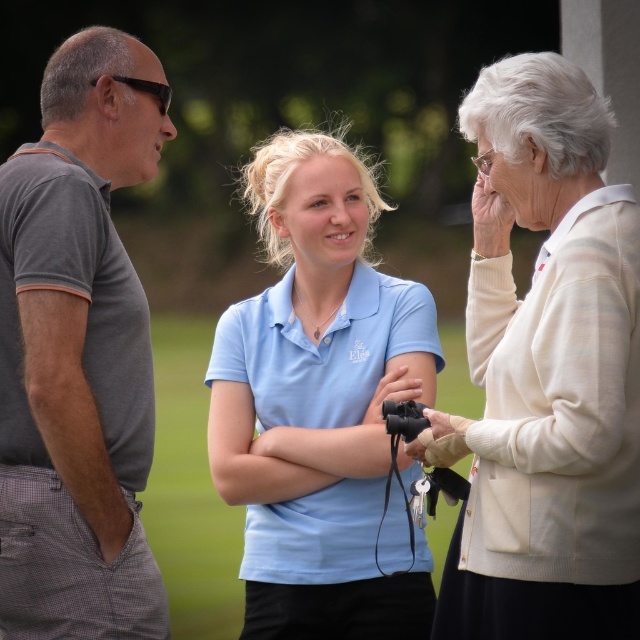
Between gray cotton polo shirt at left and black rubber binoculars at center, which one appears on the left side from the viewer's perspective?

gray cotton polo shirt at left is more to the left.

Describe the element at coordinates (77, 355) in the screenshot. I see `gray cotton polo shirt at left` at that location.

Describe the element at coordinates (77, 355) in the screenshot. The height and width of the screenshot is (640, 640). I see `gray cotton polo shirt at left` at that location.

At what (x,y) coordinates should I click in order to perform the action: click on gray cotton polo shirt at left. Please return your answer as a coordinate pair (x, y). The width and height of the screenshot is (640, 640). Looking at the image, I should click on (77, 355).

What are the coordinates of `white knit cardigan at upper right` in the screenshot? It's located at (548, 371).

Is white knit cardigan at upper right closer to the viewer compared to black rubber binoculars at center?

Yes, it is.

Who is more forward, [465,611] or [412,419]?

Point [465,611] is in front.

Where is `white knit cardigan at upper right`? white knit cardigan at upper right is located at coordinates (548, 371).

Does matte blue shirt at center appear under black rubber binoculars at center?

No.

Does matte blue shirt at center have a smaller size compared to black rubber binoculars at center?

No.

Where is `matte blue shirt at center`? This screenshot has width=640, height=640. matte blue shirt at center is located at coordinates (321, 404).